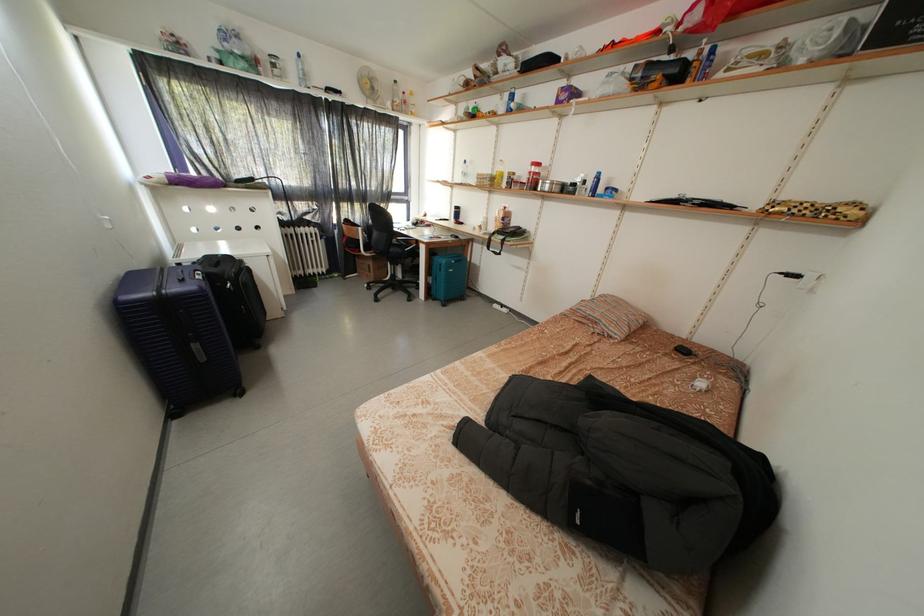
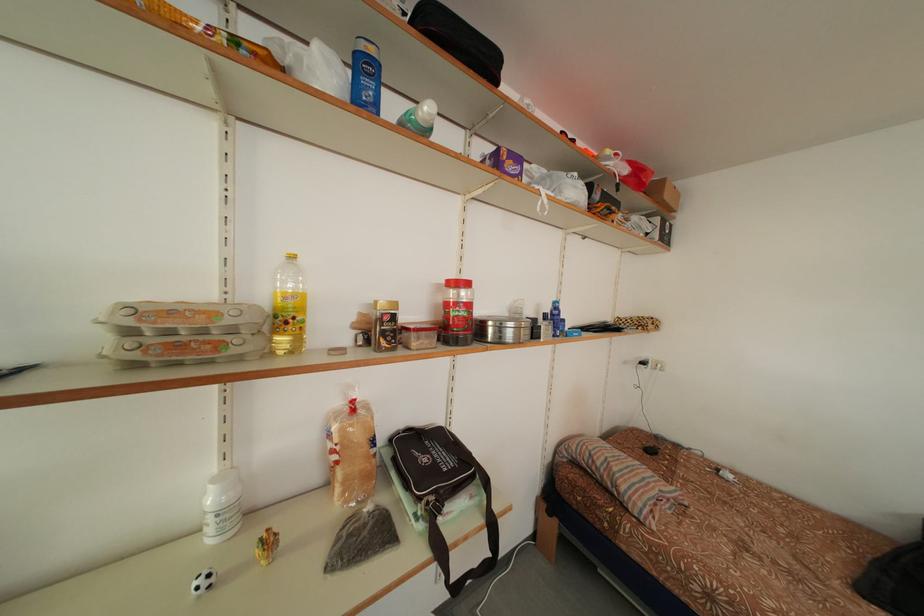
Find the pixel in the second image that matches [513,213] in the first image.

(360, 407)